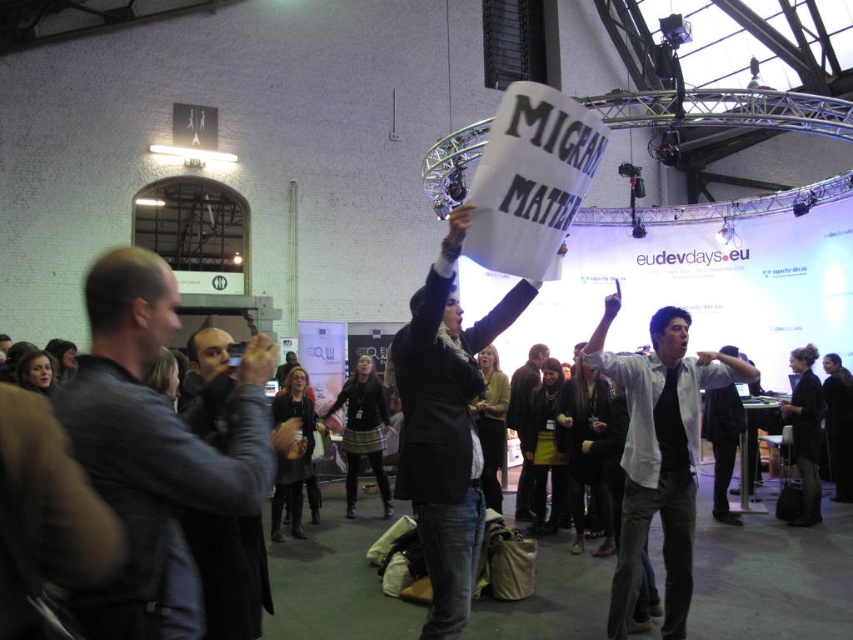
You are organizing a photo shoot and need to arrange two jackets for a fashion spread. The black matte jacket at center and the dark brown leather jacket at center are available. If you want to place them side by side, which jacket should you position on the left to make the arrangement visually balanced?

To achieve visual balance when placing the black matte jacket at center and the dark brown leather jacket at center side by side, position the larger black matte jacket at center on the left. Since it has a larger size compared to the dark brown leather jacket at center, placing it first will create a balanced composition.

In the scene described, there are two people at the center of the image wearing a white shirt at center and a dark brown leather jacket at center. From the perspective of someone standing at the front of the event, which clothing item is positioned to the right?

The white shirt at center is to the right of the dark brown leather jacket at center.